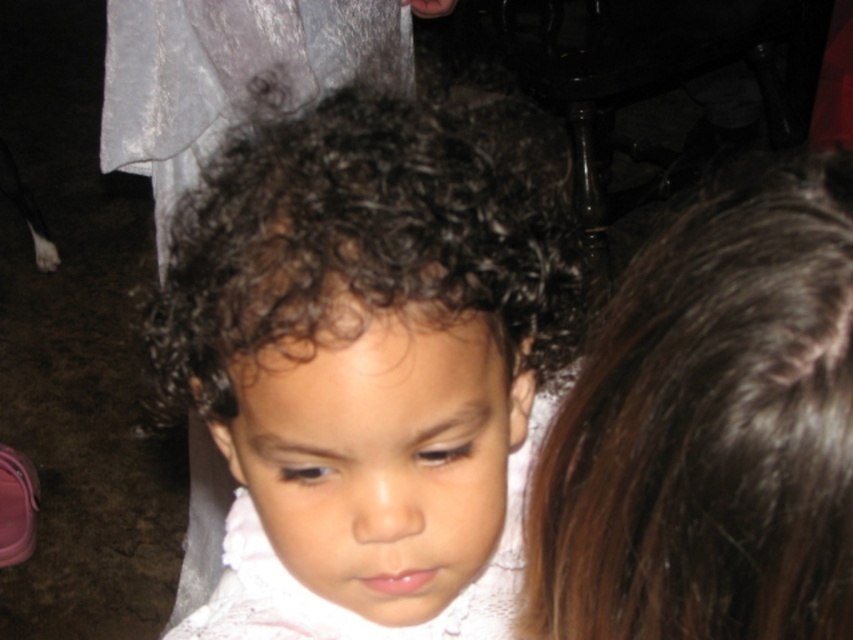
You are a photographer adjusting the camera focus. You need to ensure both the brown silky hair at upper right and the white lace dress at center are in focus. Given their sizes, which object should you prioritize focusing on first to ensure clarity?

The brown silky hair at upper right has a smaller size compared to the white lace dress at center, so you should prioritize focusing on the white lace dress at center first because larger objects often require more precise focus adjustments to capture all details clearly.

You are a photographer adjusting your camera settings. You notice the dark curly hair at center and the brown silky hair at upper right in your frame. Which hair is closer to the camera?

The dark curly hair at center is closer to the camera than the brown silky hair at upper right because it is further to the viewer.

You are standing in the room and want to move from the point closer to you to the point further away. Which path should you take to go from point (550, 257) to point (264, 556)?

The path from point (550, 257) to point (264, 556) should move towards the upper right direction since point (264, 556) is further away from the viewer compared to point (550, 257).